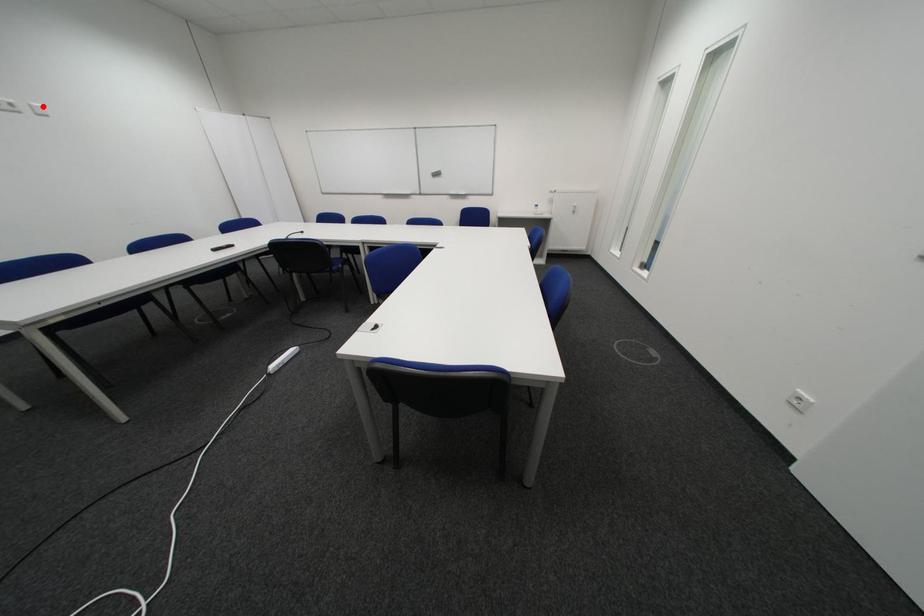
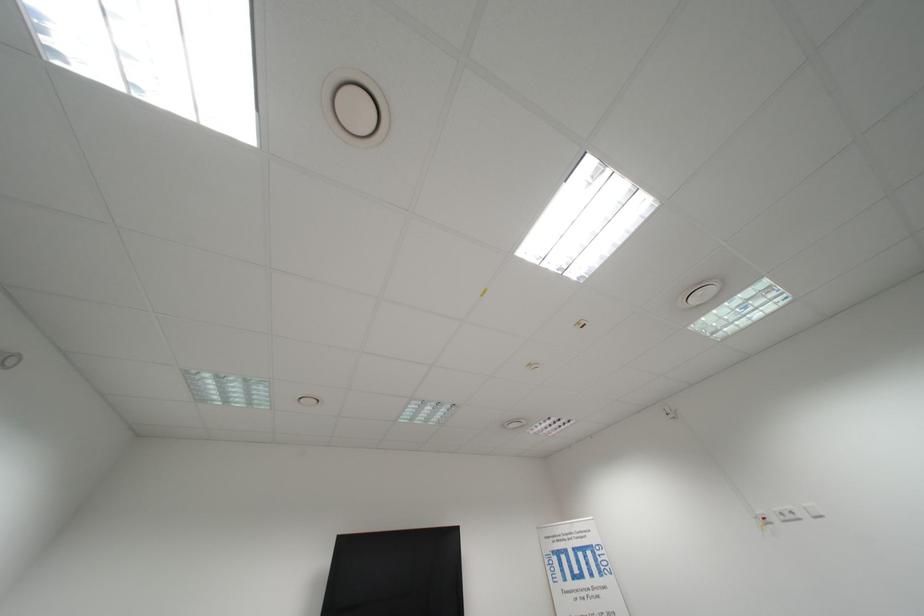
Where in the second image is the point corresponding to the highlighted location from the first image?

(818, 509)